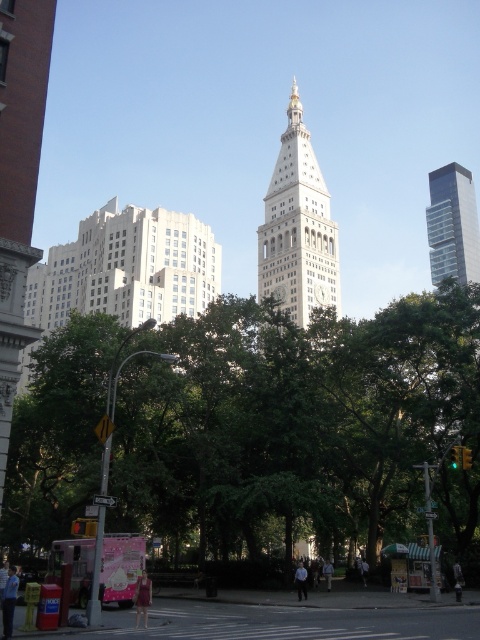
You are standing on the street and want to take a photo of both the white stone clock tower at center and the green glass traffic light at center. Which object will appear larger in your camera viewfinder?

The white stone clock tower at center will appear larger in the camera viewfinder because it is closer to you than the green glass traffic light at center.

In the scene shown: You are a delivery drone that needs to fly from the glassy reflective skyscraper at upper right to the green glass traffic light at center. The drone has a maximum flight distance of 350 feet. Can it make the trip without recharging?

The glassy reflective skyscraper at upper right and green glass traffic light at center are 359.93 feet apart from each other. Since the distance is greater than the drone maximum flight distance of 350 feet, the drone cannot make the trip without recharging.

You are a delivery driver who needs to see both the white stone clock tower at center and the green glass traffic light at center while navigating through the city. From your current position, which one is higher in the scene?

The white stone clock tower at center is positioned over the green glass traffic light at center, meaning it is higher in the scene.